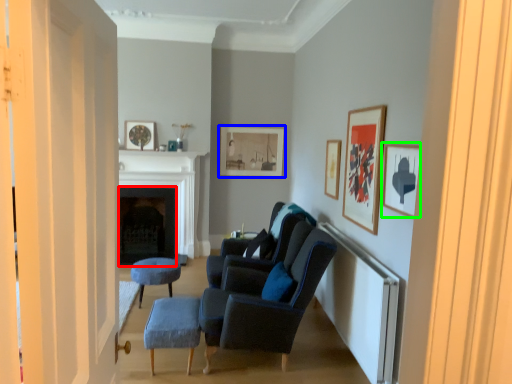
Question: Considering the real-world distances, which object is closest to fireplace (highlighted by a red box)? picture frame (highlighted by a blue box) or picture frame (highlighted by a green box).

Choices:
 (A) picture frame
 (B) picture frame

Answer: (A)